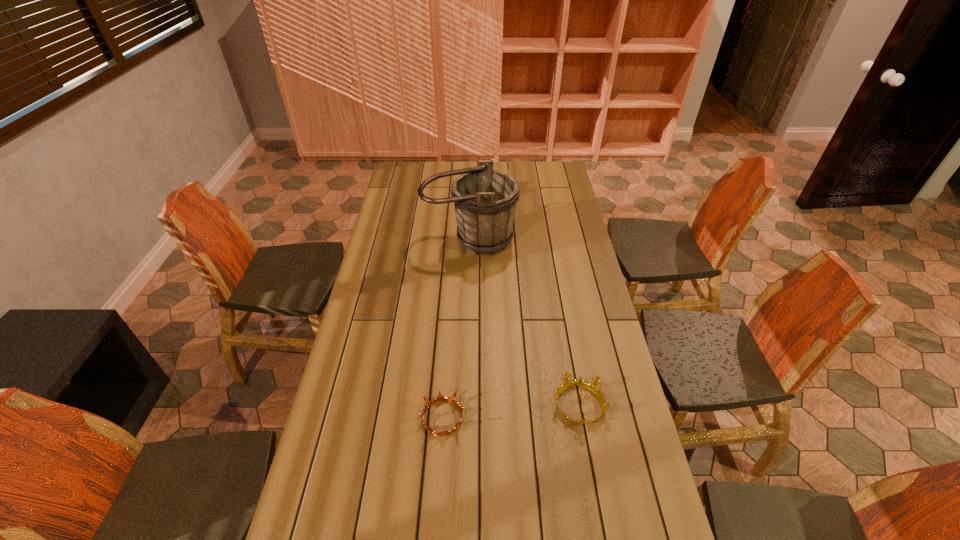
Where is `the tallest object`? the tallest object is located at coordinates pyautogui.click(x=485, y=200).

Identify the location of bucket. The image size is (960, 540). (485, 200).

You are a GUI agent. You are given a task and a screenshot of the screen. Output one action in this format:
    pyautogui.click(x=<x>, y=<y>)
    Task: Click on the third shortest object
    The width and height of the screenshot is (960, 540).
    Given the screenshot: What is the action you would take?
    pyautogui.click(x=508, y=170)

Identify the location of the farthest crown. The height and width of the screenshot is (540, 960). (508, 170).

Locate an element on the screen. the rightmost crown is located at coordinates [592, 387].

Find the location of a particular element. the leftmost crown is located at coordinates click(440, 397).

Where is `free spot located 0.290m on the handle side of the bucket`? free spot located 0.290m on the handle side of the bucket is located at coordinates (468, 313).

At what (x,y) coordinates should I click in order to perform the action: click on vacant point located 0.140m on the back of the farthest crown. Please return your answer as a coordinate pair (x, y). The image size is (960, 540). Looking at the image, I should click on (501, 171).

This screenshot has width=960, height=540. I want to click on blank space located on the front of the rightmost crown, so click(x=595, y=496).

Where is `free region located on the right of the leftmost crown`? free region located on the right of the leftmost crown is located at coordinates (502, 417).